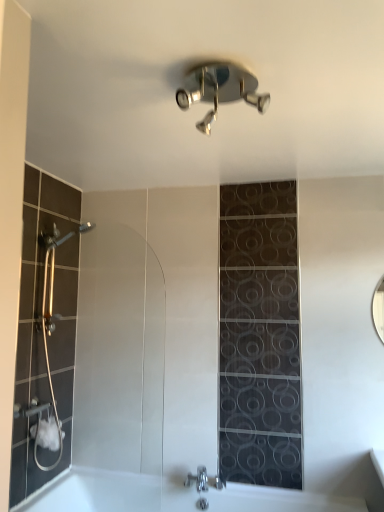
Describe the element at coordinates (204, 480) in the screenshot. I see `chrome metallic faucet at lower center` at that location.

This screenshot has height=512, width=384. In order to click on white glossy bathtub at lower center in this screenshot , I will do `click(173, 496)`.

Which object is closer to the camera taking this photo, white glossy bathtub at lower center or chrome metallic faucet at lower center?

white glossy bathtub at lower center is more forward.

Between white glossy bathtub at lower center and chrome metallic faucet at lower center, which one has larger width?

white glossy bathtub at lower center.

This screenshot has height=512, width=384. I want to click on tap behind the white glossy bathtub at lower center, so click(204, 480).

From the image's perspective, between white glossy bathtub at lower center and chrome metallic faucet at lower center, who is located below?

white glossy bathtub at lower center appears lower in the image.

The height and width of the screenshot is (512, 384). Find the location of `shower above the chrome metallic faucet at lower center (from a real-world perspective)`. shower above the chrome metallic faucet at lower center (from a real-world perspective) is located at coordinates (219, 89).

Is chrome metallic faucet at lower center positioned beyond the bounds of polished chrome shower at upper center?

Indeed, chrome metallic faucet at lower center is completely outside polished chrome shower at upper center.

Is chrome metallic faucet at lower center turned away from polished chrome shower at upper center?

No, chrome metallic faucet at lower center is not facing away from polished chrome shower at upper center.

In the image, is chrome metallic faucet at lower center on the left side or the right side of polished chrome shower at upper center?

chrome metallic faucet at lower center is to the left of polished chrome shower at upper center.

From the image's perspective, relative to white glossy bathtub at lower center, is polished chrome shower at upper center above or below?

From the image's perspective, polished chrome shower at upper center appears above white glossy bathtub at lower center.

Is white glossy bathtub at lower center at the back of polished chrome shower at upper center?

polished chrome shower at upper center does not have its back to white glossy bathtub at lower center.

Between polished chrome shower at upper center and white glossy bathtub at lower center, which one has larger size?

With larger size is white glossy bathtub at lower center.

How different are the orientations of polished chrome shower at upper center and white glossy bathtub at lower center in degrees?

polished chrome shower at upper center and white glossy bathtub at lower center are facing 0.303 degrees away from each other.

Is polished chrome shower at upper center wider than chrome metallic faucet at lower center?

Yes, polished chrome shower at upper center is wider than chrome metallic faucet at lower center.

What's the angular difference between polished chrome shower at upper center and chrome metallic faucet at lower center's facing directions?

There is a 0.252-degree angle between the facing directions of polished chrome shower at upper center and chrome metallic faucet at lower center.

From the image's perspective, between polished chrome shower at upper center and chrome metallic faucet at lower center, who is located below?

From the image's view, chrome metallic faucet at lower center is below.

Is chrome metallic faucet at lower center closer to camera compared to white glossy bathtub at lower center?

No, chrome metallic faucet at lower center is further to the viewer.

Which object is wider, chrome metallic faucet at lower center or white glossy bathtub at lower center?

white glossy bathtub at lower center.

Considering the relative sizes of chrome metallic faucet at lower center and white glossy bathtub at lower center in the image provided, is chrome metallic faucet at lower center taller than white glossy bathtub at lower center?

In fact, chrome metallic faucet at lower center may be shorter than white glossy bathtub at lower center.

Locate an element on the screen. Image resolution: width=384 pixels, height=512 pixels. shower that appears above the white glossy bathtub at lower center (from a real-world perspective) is located at coordinates (219, 89).

Considering the positions of objects white glossy bathtub at lower center and polished chrome shower at upper center in the image provided, who is more to the left, white glossy bathtub at lower center or polished chrome shower at upper center?

Positioned to the left is white glossy bathtub at lower center.

Considering the relative sizes of white glossy bathtub at lower center and polished chrome shower at upper center in the image provided, is white glossy bathtub at lower center shorter than polished chrome shower at upper center?

Incorrect, the height of white glossy bathtub at lower center does not fall short of that of polished chrome shower at upper center.

From a real-world perspective, is white glossy bathtub at lower center positioned over polished chrome shower at upper center based on gravity?

No, from a real-world perspective, white glossy bathtub at lower center is not over polished chrome shower at upper center

Locate an element on the screen. The image size is (384, 512). bath on the left of chrome metallic faucet at lower center is located at coordinates (173, 496).

Find the location of a particular element. tap below the polished chrome shower at upper center (from a real-world perspective) is located at coordinates (204, 480).

Considering their positions, is chrome metallic faucet at lower center positioned further to polished chrome shower at upper center than white glossy bathtub at lower center?

The object further to polished chrome shower at upper center is white glossy bathtub at lower center.

Estimate the real-world distances between objects in this image. Which object is further from white glossy bathtub at lower center, chrome metallic faucet at lower center or polished chrome shower at upper center?

polished chrome shower at upper center is positioned further to the anchor white glossy bathtub at lower center.

Which object lies further to the anchor point chrome metallic faucet at lower center, polished chrome shower at upper center or white glossy bathtub at lower center?

Among the two, polished chrome shower at upper center is located further to chrome metallic faucet at lower center.

From the image, which object appears to be nearer to white glossy bathtub at lower center, polished chrome shower at upper center or chrome metallic faucet at lower center?

chrome metallic faucet at lower center lies closer to white glossy bathtub at lower center than the other object.

From the image, which object appears to be farther from chrome metallic faucet at lower center, white glossy bathtub at lower center or polished chrome shower at upper center?

Based on the image, polished chrome shower at upper center appears to be further to chrome metallic faucet at lower center.

From the image, which object appears to be nearer to polished chrome shower at upper center, white glossy bathtub at lower center or chrome metallic faucet at lower center?

chrome metallic faucet at lower center is closer to polished chrome shower at upper center.

Locate an element on the screen. The image size is (384, 512). tap between polished chrome shower at upper center and white glossy bathtub at lower center in the vertical direction is located at coordinates (204, 480).